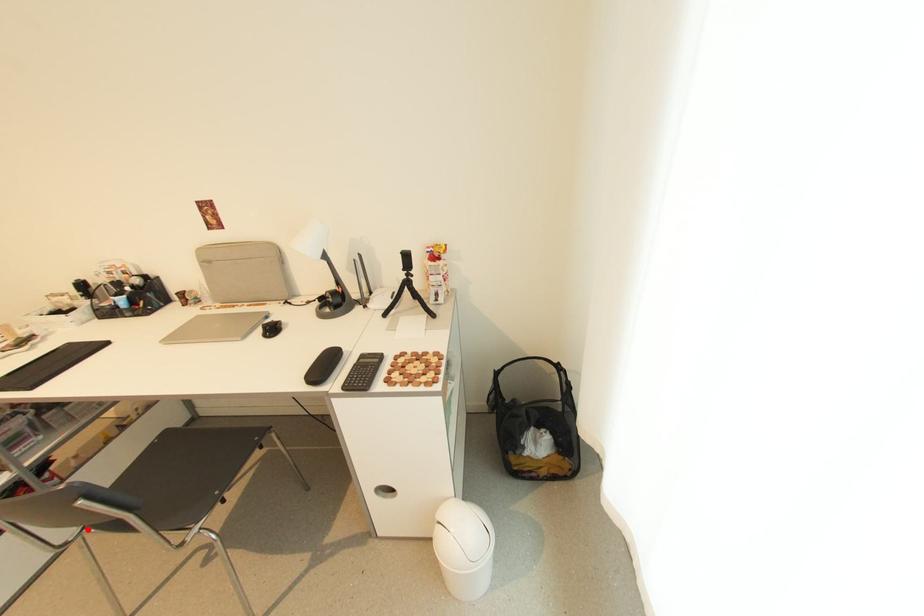
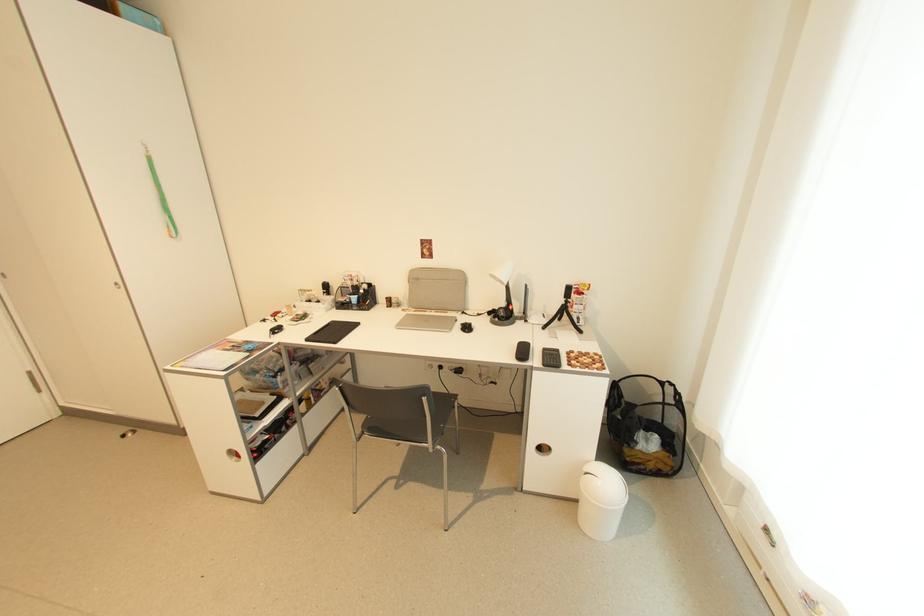
Locate, in the second image, the point that corresponds to the highlighted location in the first image.

(368, 434)